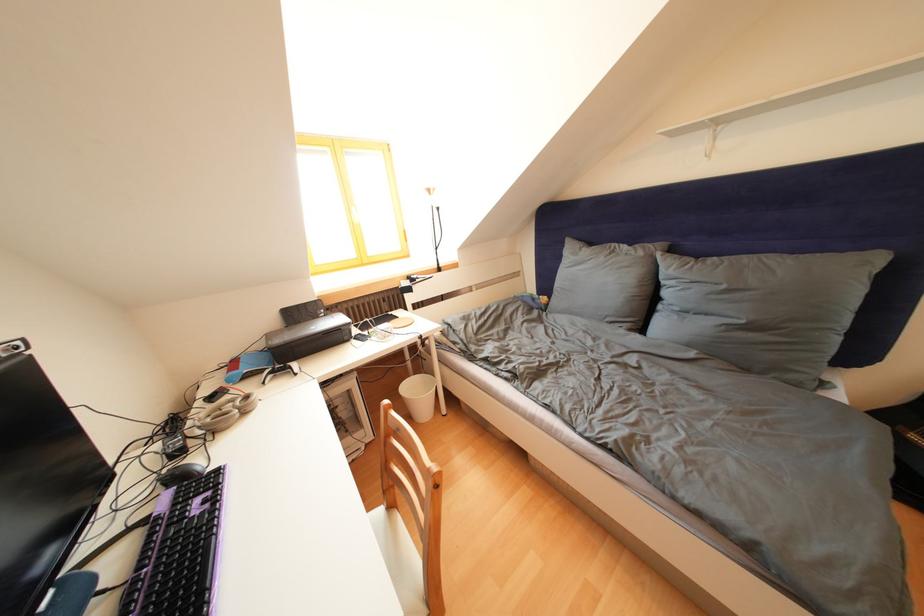
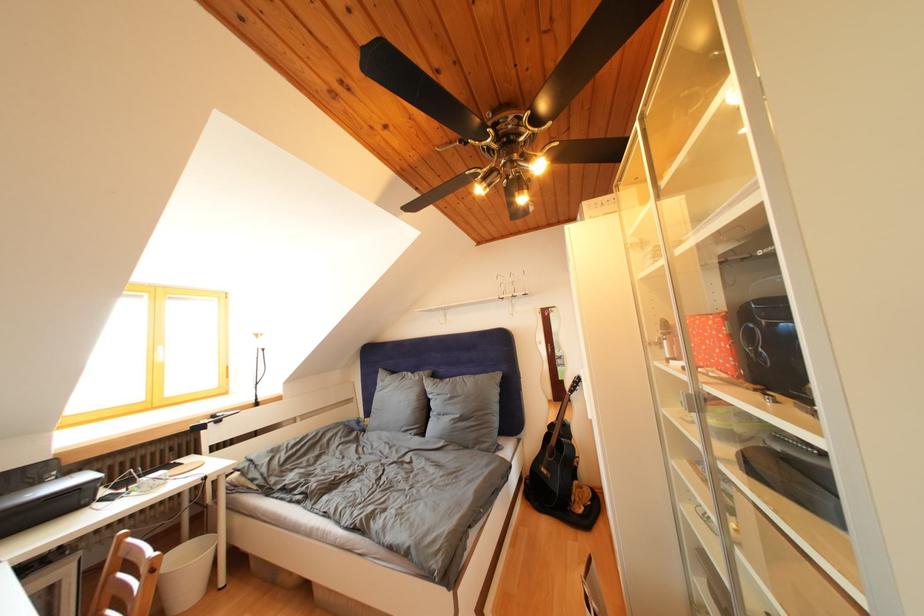
In the second image, find the point that corresponds to point (323, 322) in the first image.

(44, 488)